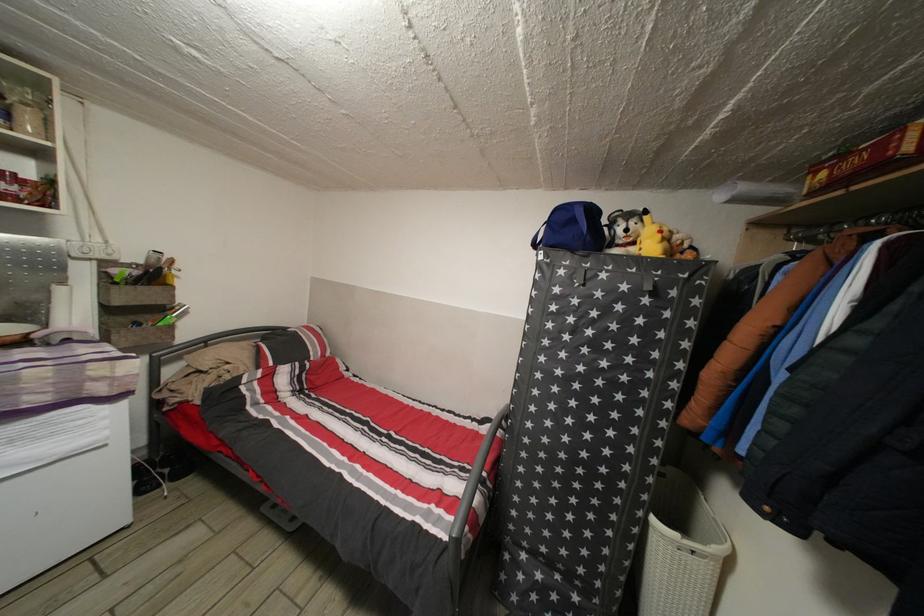
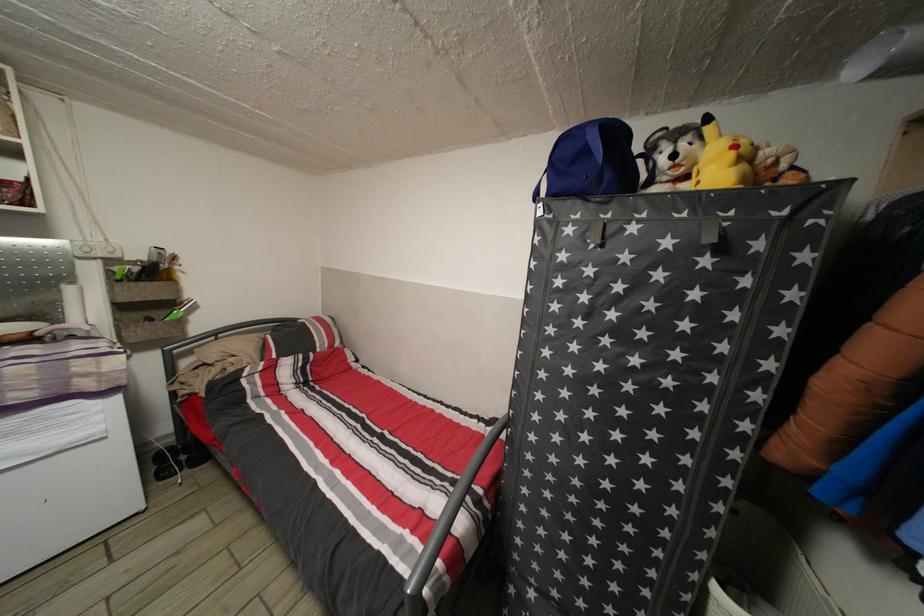
In the second image, find the point that corresponds to point 610,282 in the first image.

(639, 235)